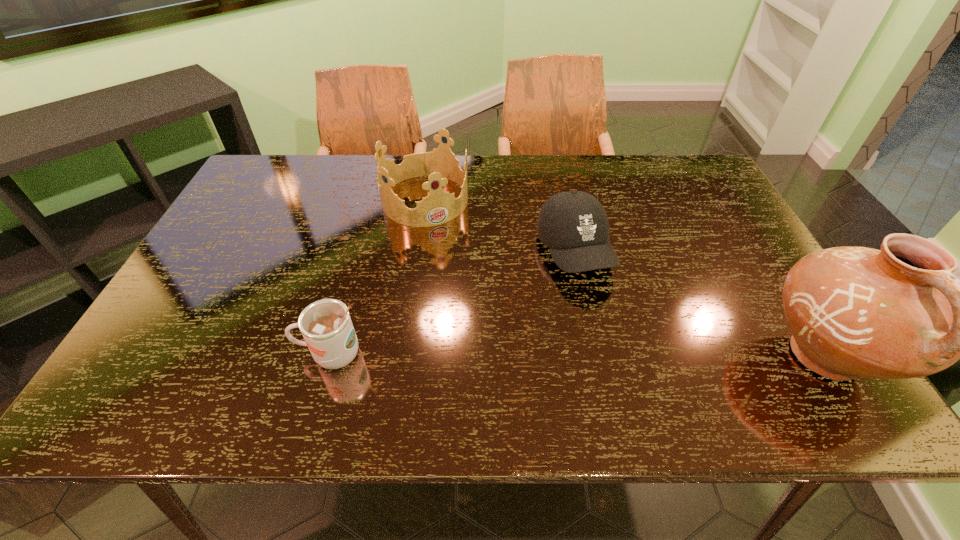
Image resolution: width=960 pixels, height=540 pixels. I want to click on free spot on the desktop that is between the cup and the pottery and is positioned on the front-facing side of the tiara, so click(515, 355).

Where is `vacant spot on the desktop that is between the cup and the pottery and is positioned on the front-facing side of the third object from left to right`? This screenshot has height=540, width=960. vacant spot on the desktop that is between the cup and the pottery and is positioned on the front-facing side of the third object from left to right is located at coordinates (627, 355).